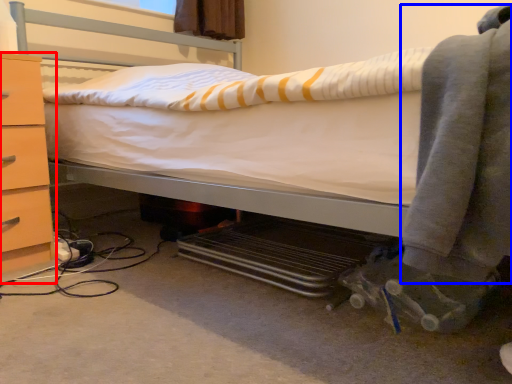
Question: Which of the following is the closest to the observer, chest of drawers (highlighted by a red box) or clothing (highlighted by a blue box)?

Choices:
 (A) chest of drawers
 (B) clothing

Answer: (B)